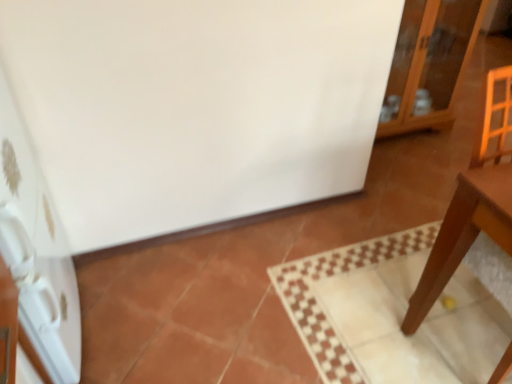
Question: Is white glossy refrigerator at left inside the boundaries of glossy wood cabinet at upper right, or outside?

Choices:
 (A) inside
 (B) outside

Answer: (B)

Question: In the image, is white glossy refrigerator at left positioned in front of or behind glossy wood cabinet at upper right?

Choices:
 (A) front
 (B) behind

Answer: (A)

Question: In terms of height, does white glossy refrigerator at left look taller or shorter compared to glossy wood cabinet at upper right?

Choices:
 (A) short
 (B) tall

Answer: (B)

Question: Is glossy wood cabinet at upper right inside the boundaries of white glossy refrigerator at left, or outside?

Choices:
 (A) outside
 (B) inside

Answer: (A)

Question: Does point (476, 9) appear closer or farther from the camera than point (30, 170)?

Choices:
 (A) farther
 (B) closer

Answer: (A)

Question: Is glossy wood cabinet at upper right in front of or behind white glossy refrigerator at left in the image?

Choices:
 (A) front
 (B) behind

Answer: (B)

Question: Considering the positions of glossy wood cabinet at upper right and white glossy refrigerator at left in the image, is glossy wood cabinet at upper right wider or thinner than white glossy refrigerator at left?

Choices:
 (A) wide
 (B) thin

Answer: (A)